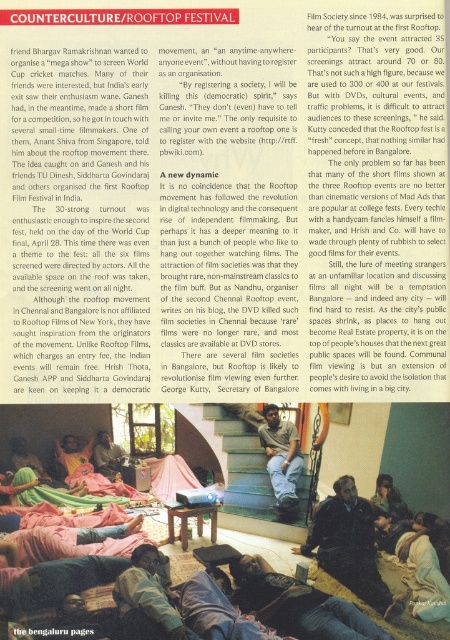
You are a photographer who just arrived at the rooftop festival location. You need to position yourself to capture a candid shot of the dark blue jeans at lower center. Where should you stand to get the best angle for this shot?

To capture the dark blue jeans at lower center, you should position yourself at point (x=297, y=604) as that is where the dark blue jeans at lower center is located.

You are a photographer standing at the edge of the rooftop where the Counterculture Rooftop Festival is taking place. You want to capture a photo that includes both the point at position (327, 540) and the point at (98, 458). Which of these two points will appear larger in your photo?

The point at position (327, 540) will appear larger in the photo because it is closer to the camera than the point at (98, 458).